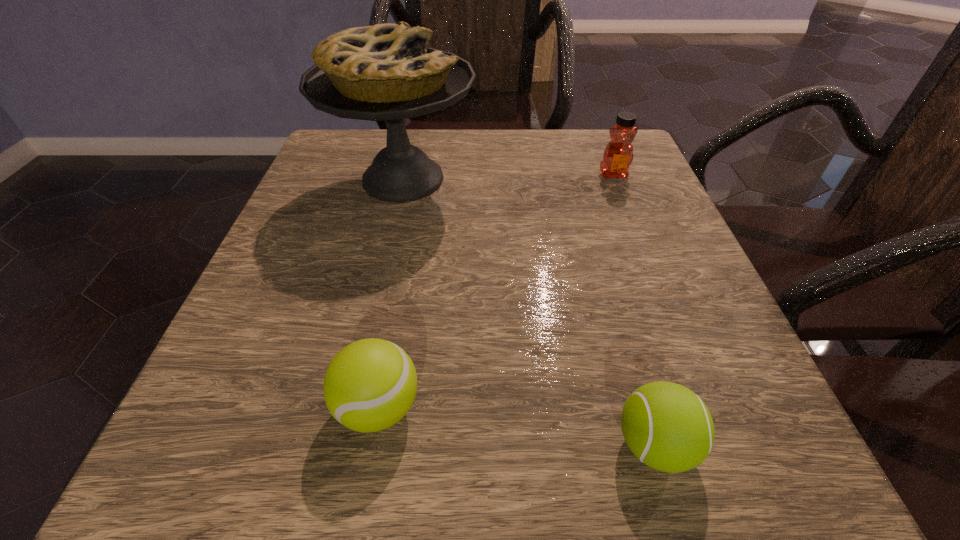
Where is `blank space that satisfies the following two spatial constraints: 1. on the front label of the honey; 2. on the cut side of the pie`? The width and height of the screenshot is (960, 540). blank space that satisfies the following two spatial constraints: 1. on the front label of the honey; 2. on the cut side of the pie is located at coordinates (615, 179).

Find the location of `free point that satisfies the following two spatial constraints: 1. on the front side of the right tennis ball; 2. on the right side of the left tennis ball`. free point that satisfies the following two spatial constraints: 1. on the front side of the right tennis ball; 2. on the right side of the left tennis ball is located at coordinates (372, 445).